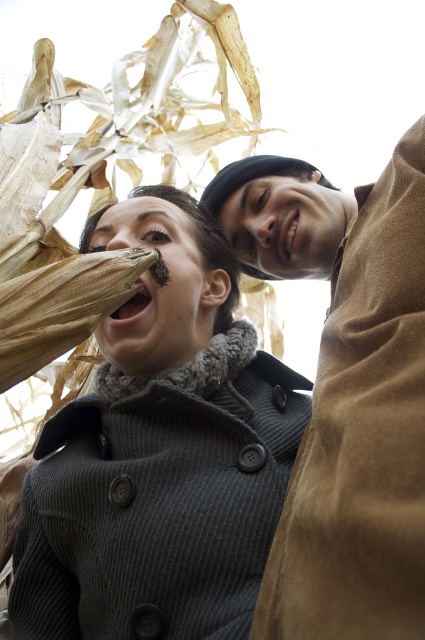
You are a photographer trying to capture a photo of both the dark gray wool coat at center and the brown textured corn at lower left. Since you want both subjects to be in focus, you need to adjust your camera settings. Considering their sizes, which subject should you focus on to ensure both are sharp?

The dark gray wool coat at center is taller than the brown textured corn at lower left. To ensure both are in focus, you should focus on the dark gray wool coat at center because it is larger and requires a narrower depth of field.

You are standing at the origin point in the image. There are two points marked in the scene. Which point is closer to you, point (377, 385) or point (13, 358)?

Point (13, 358) is closer to you because it is in front of point (377, 385).

You are a photographer trying to capture a candid shot of the two people in the scene. You want to ensure both the brown suede coat at upper right and the brown textured corn at lower left are in focus. Given that your camera can only focus on objects within a 30 inch range, will you be able to achieve this?

The brown suede coat at upper right and brown textured corn at lower left are 37.52 inches apart. Since the distance between them exceeds the camera focus range of 30 inches, you won